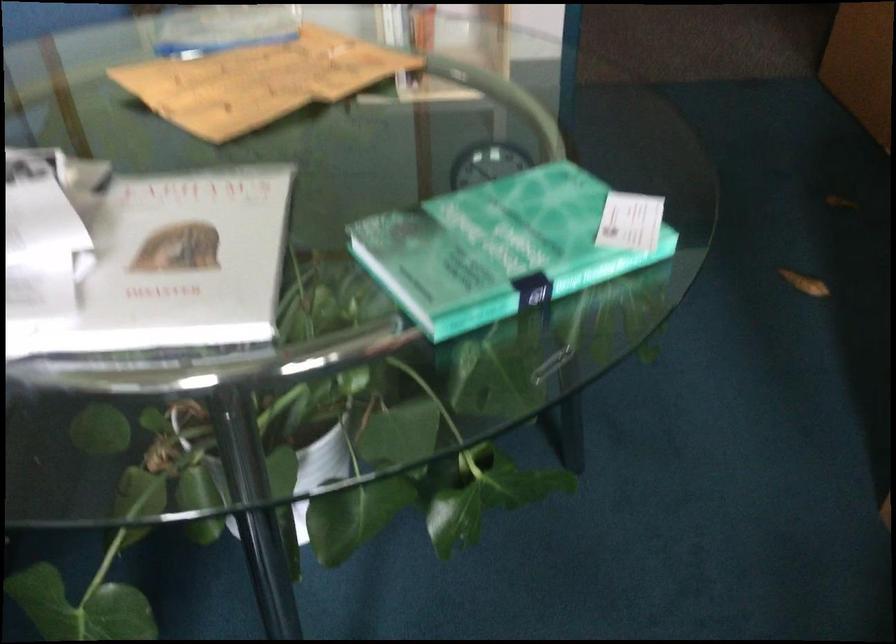
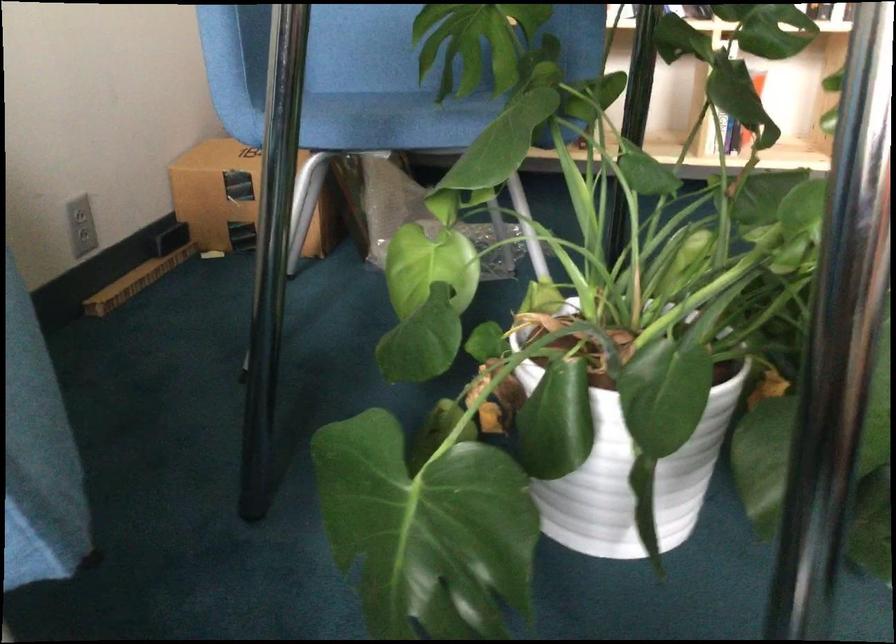
In a continuous first-person perspective shot, in which direction is the camera moving?

The cameraman walked toward left, forward.